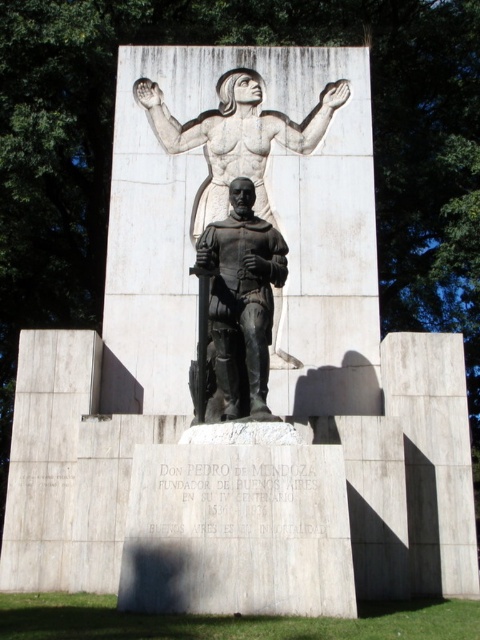
Question: Which of the following is the closest to the observer?

Choices:
 (A) (223, 221)
 (B) (224, 179)

Answer: (A)

Question: Can you confirm if bronze statue at center is thinner than smooth stone figure at upper center?

Choices:
 (A) no
 (B) yes

Answer: (B)

Question: Is bronze statue at center smaller than white stone statue at upper center?

Choices:
 (A) yes
 (B) no

Answer: (B)

Question: Based on their relative distances, which object is nearer to the smooth stone figure at upper center?

Choices:
 (A) white stone statue at upper center
 (B) bronze statue at center

Answer: (A)

Question: Does smooth stone figure at upper center have a lesser width compared to white stone statue at upper center?

Choices:
 (A) yes
 (B) no

Answer: (B)

Question: Which is nearer to the bronze statue at center?

Choices:
 (A) white stone statue at upper center
 (B) smooth stone figure at upper center

Answer: (B)